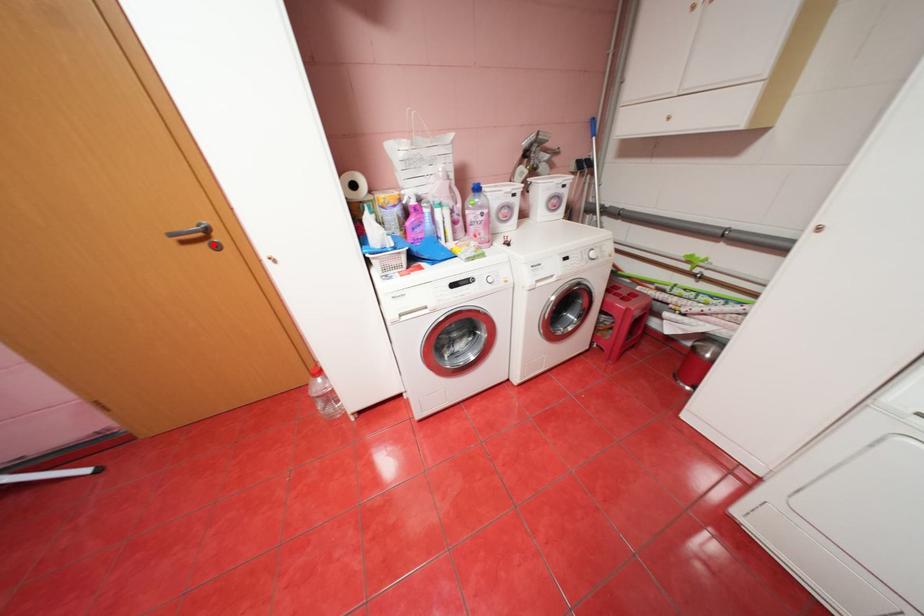
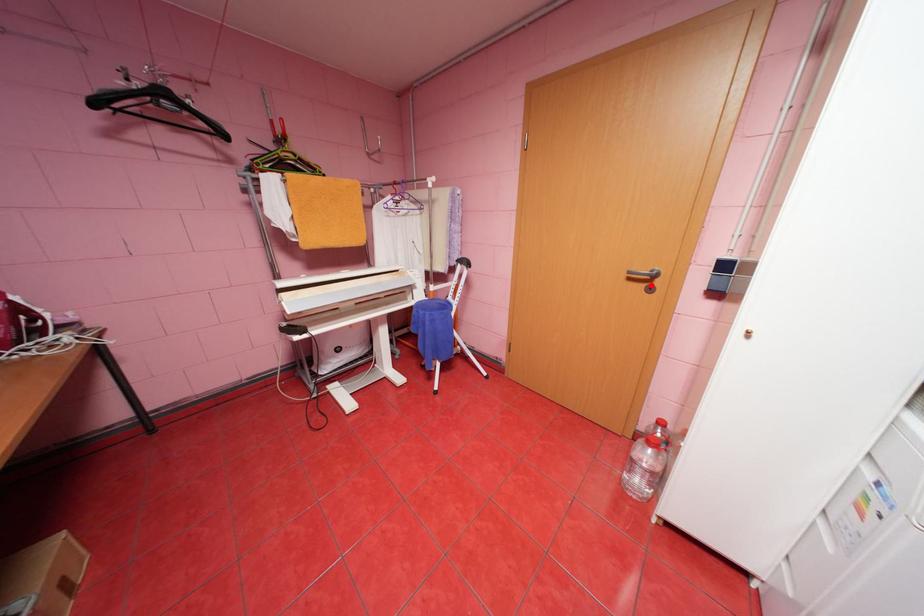
I am providing you with two images of the same scene from different viewpoints. A red point is marked on the first image and another point is marked on the second image. Is the marked point in image1 the same physical position as the marked point in image2?

Yes